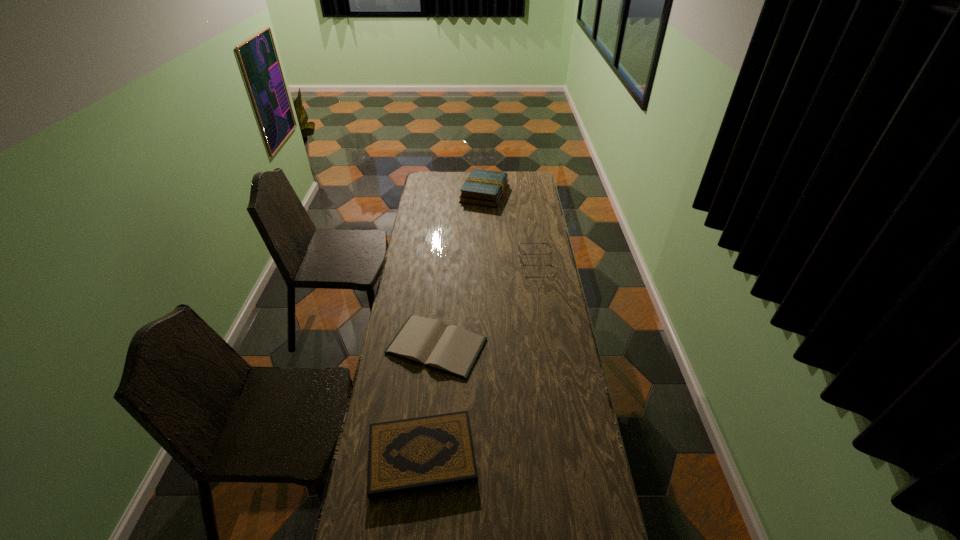
You are a GUI agent. You are given a task and a screenshot of the screen. Output one action in this format:
    pyautogui.click(x=<x>, y=<y>)
    Task: Click on the closest object to the nearest object
    
    Given the screenshot: What is the action you would take?
    pyautogui.click(x=452, y=349)

Identify which hardback book is the second nearest to the nearest object. Please provide its 2D coordinates. Your answer should be formatted as a tuple, i.e. [(x, y)], where the tuple contains the x and y coordinates of a point satisfying the conditions above.

[(482, 187)]

The height and width of the screenshot is (540, 960). I want to click on hardback book that is the nearest to the farthest hardback book, so click(x=452, y=349).

Find the location of a particular element. The height and width of the screenshot is (540, 960). vacant space that satisfies the following two spatial constraints: 1. on the back side of the shortest object; 2. on the left side of the nearest hardback book is located at coordinates (434, 346).

This screenshot has width=960, height=540. Find the location of `free space that satisfies the following two spatial constraints: 1. on the back side of the farthest object; 2. on the right side of the third farthest object`. free space that satisfies the following two spatial constraints: 1. on the back side of the farthest object; 2. on the right side of the third farthest object is located at coordinates (451, 193).

Where is `vacant space that satisfies the following two spatial constraints: 1. on the back side of the nearest hardback book; 2. on the right side of the tallest hardback book`? This screenshot has width=960, height=540. vacant space that satisfies the following two spatial constraints: 1. on the back side of the nearest hardback book; 2. on the right side of the tallest hardback book is located at coordinates (449, 193).

Locate an element on the screen. This screenshot has height=540, width=960. free space that satisfies the following two spatial constraints: 1. on the back side of the nearest hardback book; 2. on the right side of the second nearest hardback book is located at coordinates (434, 346).

The height and width of the screenshot is (540, 960). In order to click on free space that satisfies the following two spatial constraints: 1. on the front-facing side of the rightmost object; 2. on the front side of the shortest hardback book in this screenshot , I will do `click(549, 346)`.